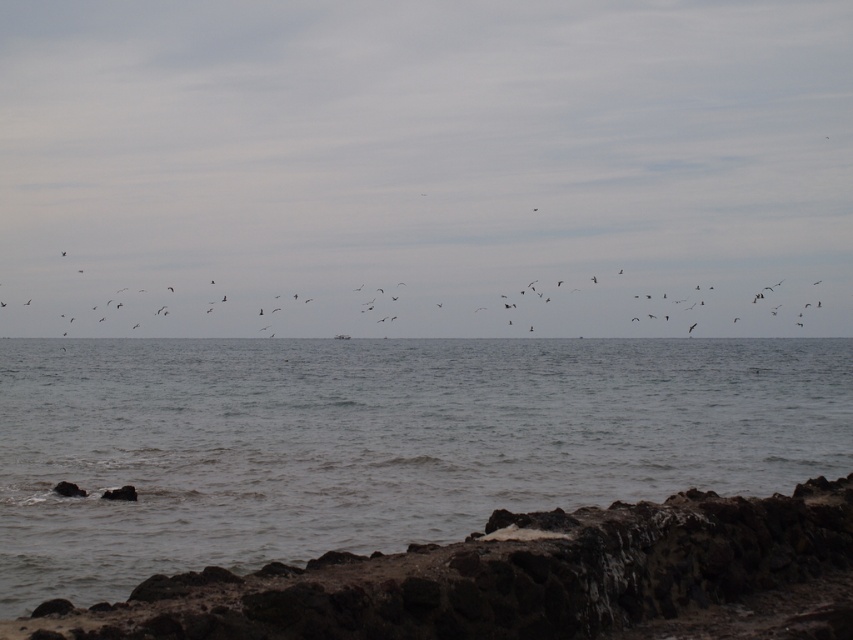
Who is positioned more to the left, gray matte water at center or rough volcanic rock at lower right?

rough volcanic rock at lower right

Is point (265, 387) less distant than point (814, 602)?

No, it is behind (814, 602).

Is point (352, 544) positioned before point (700, 609)?

No, it is behind (700, 609).

I want to click on gray matte water at center, so click(x=376, y=442).

Is gray matte water at center above dark gray feathers at upper center?

Actually, gray matte water at center is below dark gray feathers at upper center.

Between point (308, 534) and point (45, 314), which one is positioned behind?

The point (45, 314) is behind.

Is point (396, 417) positioned in front of point (65, 308)?

Yes, it is in front of point (65, 308).

What are the coordinates of `gray matte water at center` in the screenshot? It's located at (376, 442).

Looking at this image, which is more to the left, rough volcanic rock at lower right or dark gray feathers at upper center?

dark gray feathers at upper center is more to the left.

Is rough volcanic rock at lower right thinner than dark gray feathers at upper center?

Yes, rough volcanic rock at lower right is thinner than dark gray feathers at upper center.

Measure the distance between rough volcanic rock at lower right and camera.

rough volcanic rock at lower right is 8.12 meters away from camera.

The image size is (853, 640). I want to click on rough volcanic rock at lower right, so click(x=526, y=580).